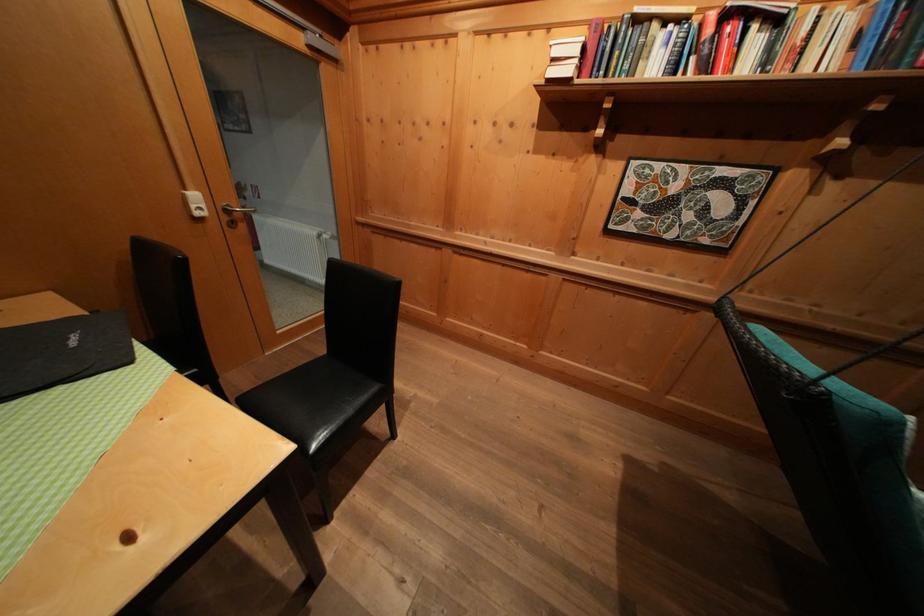
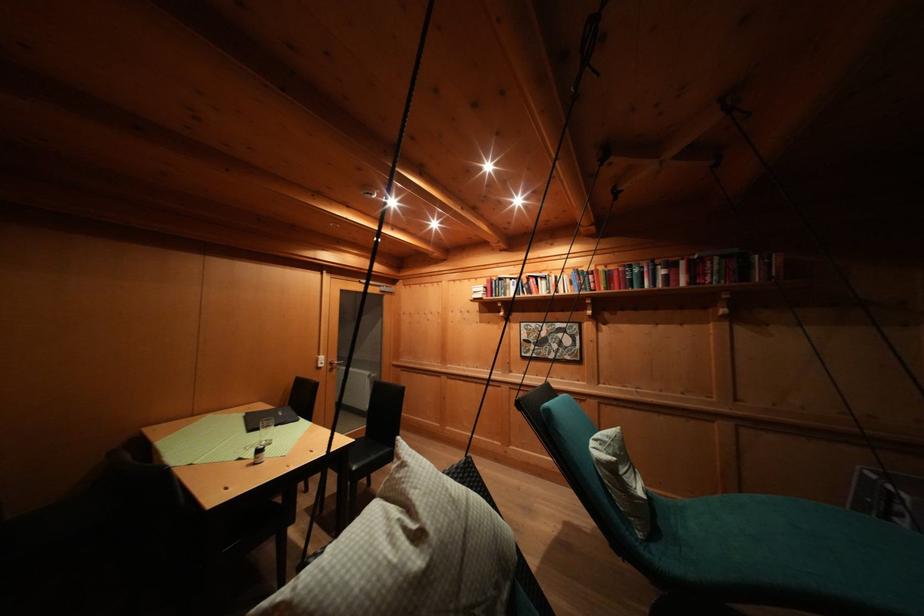
Find the pixel in the second image that matches point (201, 200) in the first image.

(327, 362)